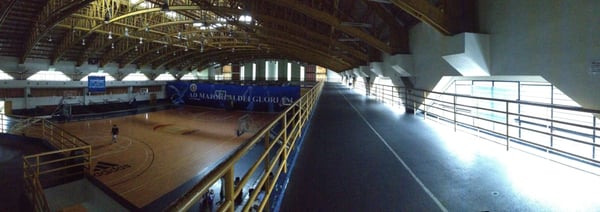
What are the coordinates of `gym floor` in the screenshot? It's located at (180, 137).